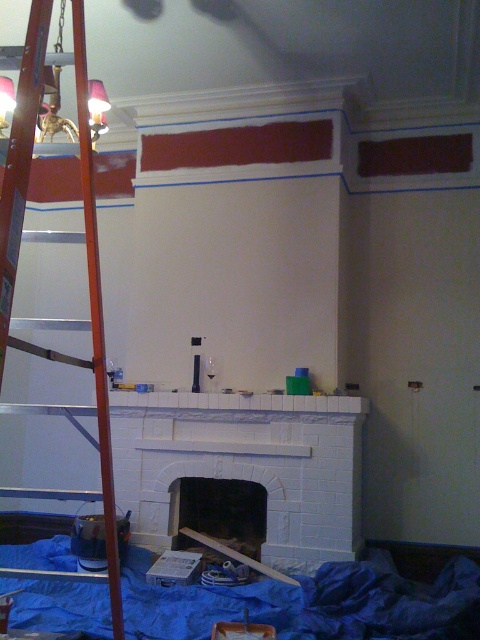
Question: Is white brick fireplace at center further to the viewer compared to wooden at left?

Choices:
 (A) no
 (B) yes

Answer: (B)

Question: Is white brick fireplace at center wider than wooden at left?

Choices:
 (A) yes
 (B) no

Answer: (A)

Question: Which point is farther to the camera?

Choices:
 (A) (87, 161)
 (B) (255, 406)

Answer: (B)

Question: Can you confirm if white brick fireplace at center is positioned below wooden at left?

Choices:
 (A) no
 (B) yes

Answer: (B)

Question: Among these points, which one is farthest from the camera?

Choices:
 (A) (93, 257)
 (B) (175, 406)

Answer: (B)